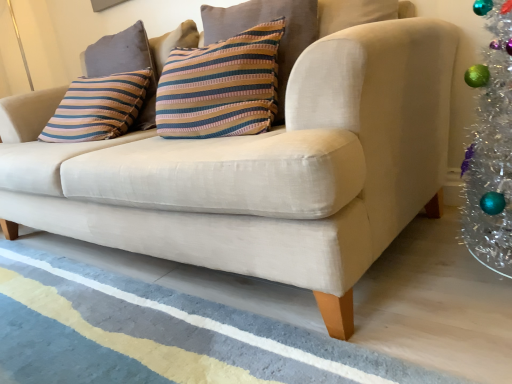
Describe the element at coordinates (221, 86) in the screenshot. The width and height of the screenshot is (512, 384). I see `striped fabric pillow at center, the 2th pillow viewed from the left` at that location.

Image resolution: width=512 pixels, height=384 pixels. Identify the location of striped fabric pillow at center, acting as the first pillow starting from the right. (221, 86).

Who is smaller, striped fabric pillow at center, which appears as the first pillow when viewed from the front, or blue textured rug at lower center?

Smaller between the two is blue textured rug at lower center.

Is there a large distance between striped fabric pillow at center, which appears as the first pillow when viewed from the front, and blue textured rug at lower center?

No, striped fabric pillow at center, which appears as the first pillow when viewed from the front, is not far from blue textured rug at lower center.

Which object is positioned more to the left, striped fabric pillow at center, which appears as the first pillow when viewed from the front, or blue textured rug at lower center?

From the viewer's perspective, blue textured rug at lower center appears more on the left side.

From a real-world perspective, which object stands above the other?

From a 3D spatial view, striped fabric pillow at upper left, the second pillow positioned from the right, is above.

In terms of height, does blue textured rug at lower center look taller or shorter compared to striped fabric pillow at upper left, the 1th pillow positioned from the back?

Clearly, blue textured rug at lower center is shorter compared to striped fabric pillow at upper left, the 1th pillow positioned from the back.

Considering the positions of objects blue textured rug at lower center and striped fabric pillow at upper left, which is the 1th pillow in left-to-right order, in the image provided, who is more to the right, blue textured rug at lower center or striped fabric pillow at upper left, which is the 1th pillow in left-to-right order,?

blue textured rug at lower center.

From the image's perspective, is blue textured rug at lower center located above striped fabric pillow at upper left, which appears as the 2th pillow when viewed from the front?

No, from the image's perspective, blue textured rug at lower center is not over striped fabric pillow at upper left, which appears as the 2th pillow when viewed from the front.

From the image's perspective, which one is positioned lower, striped fabric pillow at upper left, which appears as the 2th pillow when viewed from the front, or striped fabric pillow at center, the 2th pillow viewed from the left?

striped fabric pillow at center, the 2th pillow viewed from the left, appears lower in the image.

Does point (115, 40) appear closer or farther from the camera than point (280, 33)?

Clearly, point (115, 40) is more distant from the camera than point (280, 33).

Between striped fabric pillow at upper left, which appears as the 2th pillow when viewed from the front, and striped fabric pillow at center, the 2th pillow viewed from the left, which one has smaller width?

striped fabric pillow at upper left, which appears as the 2th pillow when viewed from the front, is thinner.

Which object is wider, striped fabric pillow at upper left, the 1th pillow positioned from the back, or blue textured rug at lower center?

With larger width is blue textured rug at lower center.

From a real-world perspective, relative to blue textured rug at lower center, is striped fabric pillow at upper left, the 1th pillow positioned from the back, vertically above or below?

striped fabric pillow at upper left, the 1th pillow positioned from the back, is above blue textured rug at lower center.

How many degrees apart are the facing directions of striped fabric pillow at upper left, which appears as the 2th pillow when viewed from the front, and blue textured rug at lower center?

There is a 90-degree angle between the facing directions of striped fabric pillow at upper left, which appears as the 2th pillow when viewed from the front, and blue textured rug at lower center.

Considering the positions of objects striped fabric pillow at upper left, the second pillow positioned from the right, and blue textured rug at lower center in the image provided, who is in front, striped fabric pillow at upper left, the second pillow positioned from the right, or blue textured rug at lower center?

blue textured rug at lower center is more forward.

Is striped fabric pillow at center, which appears as the first pillow when viewed from the front, oriented away from striped fabric pillow at upper left, the 1th pillow positioned from the back?

That's not correct — striped fabric pillow at center, which appears as the first pillow when viewed from the front, is not looking away from striped fabric pillow at upper left, the 1th pillow positioned from the back.

From the image's perspective, relative to striped fabric pillow at upper left, which appears as the 2th pillow when viewed from the front, is striped fabric pillow at center, which is the second pillow in back-to-front order, above or below?

From the image's perspective, striped fabric pillow at center, which is the second pillow in back-to-front order, appears below striped fabric pillow at upper left, which appears as the 2th pillow when viewed from the front.

Considering the sizes of objects striped fabric pillow at center, which appears as the first pillow when viewed from the front, and striped fabric pillow at upper left, which appears as the 2th pillow when viewed from the front, in the image provided, who is bigger, striped fabric pillow at center, which appears as the first pillow when viewed from the front, or striped fabric pillow at upper left, which appears as the 2th pillow when viewed from the front,?

striped fabric pillow at center, which appears as the first pillow when viewed from the front, is bigger.

Considering the relative positions of striped fabric pillow at center, which appears as the first pillow when viewed from the front, and striped fabric pillow at upper left, the 1th pillow positioned from the back, in the image provided, is striped fabric pillow at center, which appears as the first pillow when viewed from the front, to the left or to the right of striped fabric pillow at upper left, the 1th pillow positioned from the back,?

In the image, striped fabric pillow at center, which appears as the first pillow when viewed from the front, appears on the right side of striped fabric pillow at upper left, the 1th pillow positioned from the back.

Is blue textured rug at lower center next to striped fabric pillow at center, the 2th pillow viewed from the left, and touching it?

No, blue textured rug at lower center is not next to striped fabric pillow at center, the 2th pillow viewed from the left.

Is blue textured rug at lower center positioned before striped fabric pillow at center, which is the second pillow in back-to-front order?

Yes, the depth of blue textured rug at lower center is less than that of striped fabric pillow at center, which is the second pillow in back-to-front order.

Measure the distance between blue textured rug at lower center and striped fabric pillow at center, which appears as the first pillow when viewed from the front.

24.68 inches.

From the image's perspective, is blue textured rug at lower center located beneath striped fabric pillow at center, the 2th pillow viewed from the left?

Indeed, from the image's perspective, blue textured rug at lower center is shown beneath striped fabric pillow at center, the 2th pillow viewed from the left.

Image resolution: width=512 pixels, height=384 pixels. I want to click on the 1st pillow located above the blue textured rug at lower center (from a real-world perspective), so click(x=221, y=86).

The width and height of the screenshot is (512, 384). Find the location of `stripe beneath the striped fabric pillow at upper left, which appears as the 2th pillow when viewed from the front (from a real-world perspective)`. stripe beneath the striped fabric pillow at upper left, which appears as the 2th pillow when viewed from the front (from a real-world perspective) is located at coordinates (205, 322).

Which object lies nearer to the anchor point blue textured rug at lower center, striped fabric pillow at center, which is the second pillow in back-to-front order, or striped fabric pillow at upper left, the 1th pillow positioned from the back?

Among the two, striped fabric pillow at center, which is the second pillow in back-to-front order, is located nearer to blue textured rug at lower center.

Considering their positions, is striped fabric pillow at upper left, which appears as the 2th pillow when viewed from the front, positioned closer to blue textured rug at lower center than striped fabric pillow at center, acting as the first pillow starting from the right?

striped fabric pillow at center, acting as the first pillow starting from the right.

Which object lies further to the anchor point striped fabric pillow at center, which is the second pillow in back-to-front order, striped fabric pillow at upper left, which appears as the 2th pillow when viewed from the front, or blue textured rug at lower center?

The object further to striped fabric pillow at center, which is the second pillow in back-to-front order, is blue textured rug at lower center.

When comparing their distances from striped fabric pillow at upper left, which is the 1th pillow in left-to-right order, does striped fabric pillow at center, which is the second pillow in back-to-front order, or blue textured rug at lower center seem further?

blue textured rug at lower center is further to striped fabric pillow at upper left, which is the 1th pillow in left-to-right order.

Based on their spatial positions, is blue textured rug at lower center or striped fabric pillow at upper left, the second pillow positioned from the right, closer to striped fabric pillow at center, the 2th pillow viewed from the left?

striped fabric pillow at upper left, the second pillow positioned from the right, is positioned closer to the anchor striped fabric pillow at center, the 2th pillow viewed from the left.

From the image, which object appears to be farther from striped fabric pillow at upper left, which appears as the 2th pillow when viewed from the front, blue textured rug at lower center or striped fabric pillow at center, acting as the first pillow starting from the right?

Based on the image, blue textured rug at lower center appears to be further to striped fabric pillow at upper left, which appears as the 2th pillow when viewed from the front.

What are the coordinates of `pillow between blue textured rug at lower center and striped fabric pillow at upper left, which is the 1th pillow in left-to-right order, from front to back` in the screenshot? It's located at (221, 86).